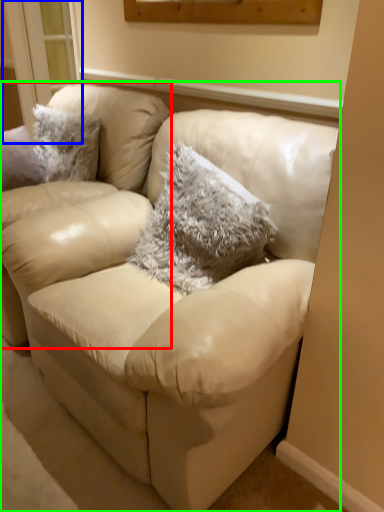
Question: Which is nearer to the chair (highlighted by a red box)? window (highlighted by a blue box) or studio couch (highlighted by a green box).

Choices:
 (A) window
 (B) studio couch

Answer: (B)